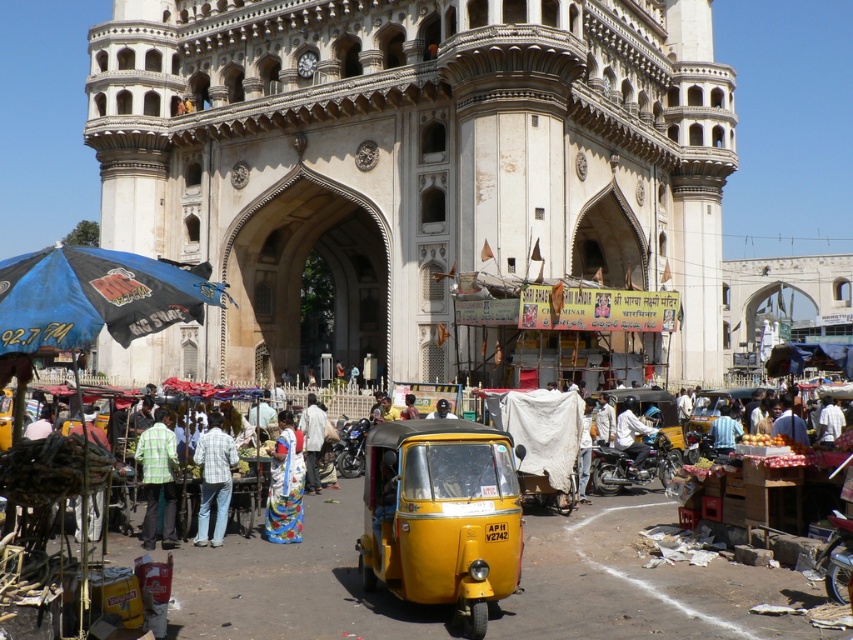
Which of these two, white fabric at center or dark blue fabric at center, stands shorter?

Standing shorter between the two is dark blue fabric at center.

The width and height of the screenshot is (853, 640). Describe the element at coordinates (605, 420) in the screenshot. I see `white fabric at center` at that location.

The width and height of the screenshot is (853, 640). What do you see at coordinates (605, 420) in the screenshot?
I see `white fabric at center` at bounding box center [605, 420].

Where is `white fabric at center`? This screenshot has height=640, width=853. white fabric at center is located at coordinates (605, 420).

Is white fabric cloth at center to the right of dark blue fabric at center from the viewer's perspective?

Correct, you'll find white fabric cloth at center to the right of dark blue fabric at center.

The image size is (853, 640). I want to click on white fabric cloth at center, so click(x=631, y=435).

Does white cotton shirt at center have a lesser width compared to dark blue fabric at center?

No, white cotton shirt at center is not thinner than dark blue fabric at center.

Who is more forward, (312, 403) or (450, 406)?

Point (450, 406)

The image size is (853, 640). I want to click on white cotton shirt at center, so click(x=312, y=440).